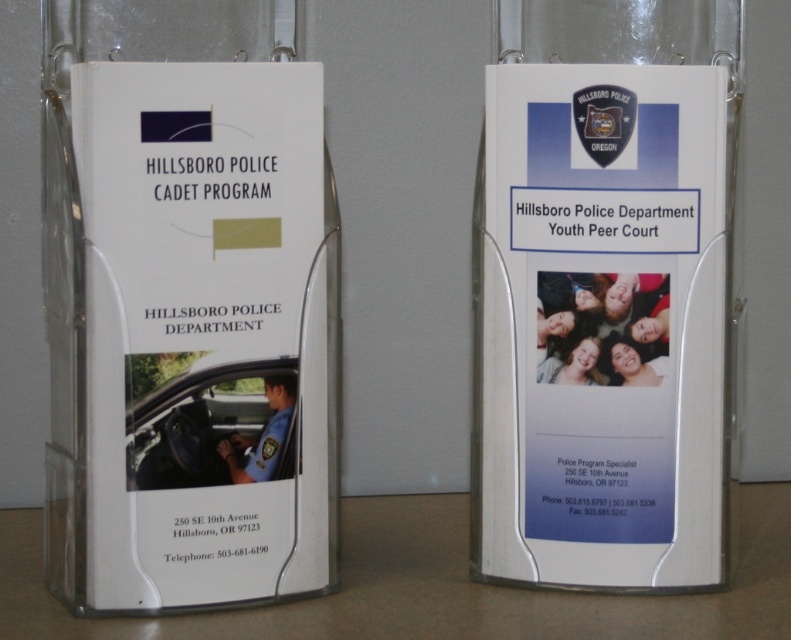
You are a visitor at the Hillsboro Police Department and need to place a small item on the nearest surface to the white plastic brochure at right. Is the white plastic table at lower center close enough for you to use?

The white plastic brochure at right is 5.24 inches from the white plastic table at lower center, so yes, the table is close enough for you to place the item nearby.

You are standing in front of the Hillsboro Police Department information display. You see a white plastic brochure at right and a white plastic table at lower center. Which object is positioned more to the right?

The white plastic brochure at right is positioned more to the right than the white plastic table at lower center according to the description.

From the picture: You are standing in front of two brochures displayed in clear plastic holders against a white wall. The brochures are for the Hillsboro Police Department. There is a point marked at coordinates (604, 294). Which brochure is this point located on?

The point at coordinates (604, 294) is on the white plastic brochure at right.